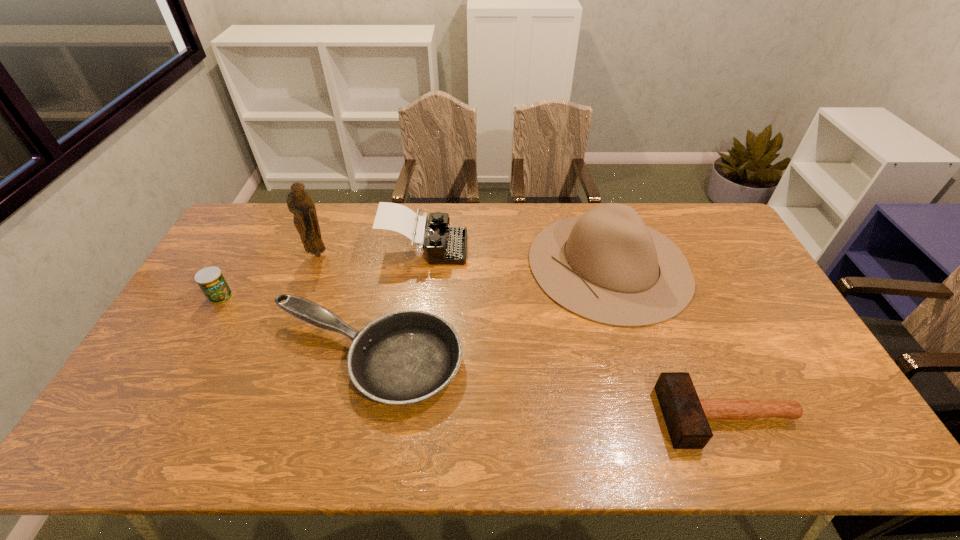
This screenshot has width=960, height=540. I want to click on free space that satisfies the following two spatial constraints: 1. on the keys of the sombrero; 2. on the right side of the typewriter, so click(x=422, y=265).

You are a GUI agent. You are given a task and a screenshot of the screen. Output one action in this format:
    pyautogui.click(x=<x>, y=<y>)
    Task: Click on the vacant region that satisfies the following two spatial constraints: 1. on the keys of the fourth shortest object; 2. on the left side of the fifth shortest object
    The image size is (960, 540).
    Given the screenshot: What is the action you would take?
    pyautogui.click(x=422, y=265)